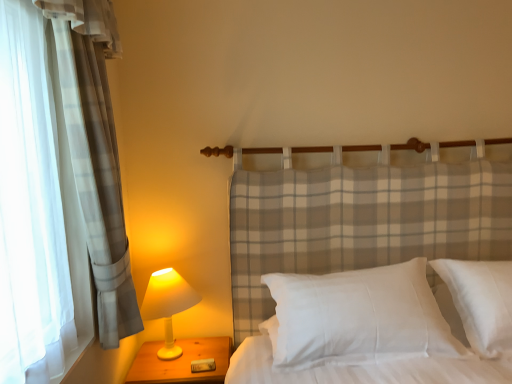
Question: Considering the relative sizes of white cotton pillow at center and wooden nightstand at lower left in the image provided, is white cotton pillow at center smaller than wooden nightstand at lower left?

Choices:
 (A) yes
 (B) no

Answer: (B)

Question: Is white cotton pillow at center oriented away from wooden nightstand at lower left?

Choices:
 (A) no
 (B) yes

Answer: (A)

Question: Is white cotton pillow at center at the left side of wooden nightstand at lower left?

Choices:
 (A) yes
 (B) no

Answer: (B)

Question: From the image's perspective, is white cotton pillow at center over wooden nightstand at lower left?

Choices:
 (A) no
 (B) yes

Answer: (B)

Question: Is white cotton pillow at center further to the viewer compared to wooden nightstand at lower left?

Choices:
 (A) no
 (B) yes

Answer: (A)

Question: Is white matte lamp at left taller or shorter than white cotton pillow at center?

Choices:
 (A) tall
 (B) short

Answer: (A)

Question: In terms of size, does white matte lamp at left appear bigger or smaller than white cotton pillow at center?

Choices:
 (A) big
 (B) small

Answer: (B)

Question: From the image's perspective, is white matte lamp at left located above or below white cotton pillow at center?

Choices:
 (A) below
 (B) above

Answer: (A)

Question: In terms of width, does white matte lamp at left look wider or thinner when compared to white cotton pillow at center?

Choices:
 (A) thin
 (B) wide

Answer: (A)

Question: From a real-world perspective, is wooden nightstand at lower left above or below white satin pillow at center?

Choices:
 (A) above
 (B) below

Answer: (B)

Question: Considering the positions of point (150, 369) and point (490, 261), is point (150, 369) closer or farther from the camera than point (490, 261)?

Choices:
 (A) closer
 (B) farther

Answer: (B)

Question: Is wooden nightstand at lower left to the left or to the right of white satin pillow at center in the image?

Choices:
 (A) right
 (B) left

Answer: (B)

Question: In terms of height, does wooden nightstand at lower left look taller or shorter compared to white satin pillow at center?

Choices:
 (A) short
 (B) tall

Answer: (A)

Question: Is white satin pillow at center spatially inside white cotton pillow at center, or outside of it?

Choices:
 (A) inside
 (B) outside

Answer: (B)

Question: Considering the relative positions of white satin pillow at center and white cotton pillow at center in the image provided, is white satin pillow at center to the left or to the right of white cotton pillow at center?

Choices:
 (A) right
 (B) left

Answer: (A)